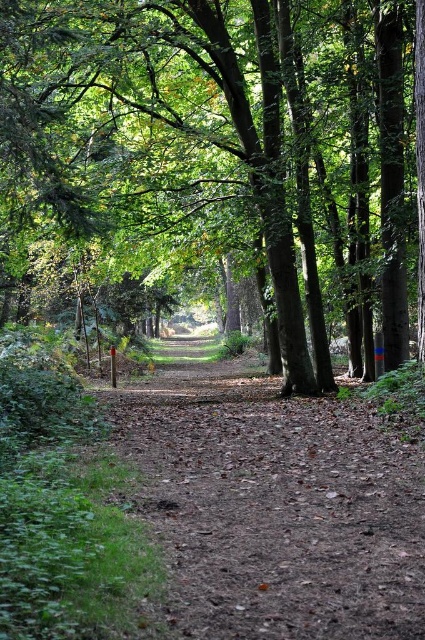
You are standing at the point marked as point (221, 154) in the forest path. What object is located exactly at that point?

The point (221, 154) corresponds to the brown textured tree at center.

You are standing on the forest path and see two points marked on the ground. The first point is at coordinates point (311, 51) and the second is at point (359, 454). If you are facing the direction of the path, which point is closer to you?

Point (359, 454) is closer to you because it is in front of point (311, 51).

You are standing at the entrance of the forest path and want to reach the brown textured tree at center. Based on the coordinates provided in the Objects Description, in which direction should you walk from your current position to reach the tree?

The brown textured tree at center is located at coordinates point (221, 154). Since you are at the entrance, which is likely at the starting point of the path, you should walk forward along the path towards the center to reach the tree.